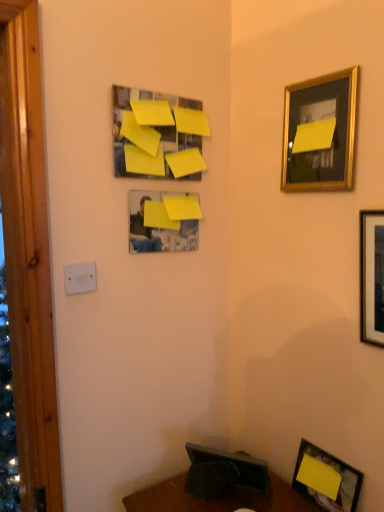
Question: Is point (84, 265) closer or farther from the camera than point (342, 181)?

Choices:
 (A) closer
 (B) farther

Answer: (B)

Question: Considering the positions of white plastic/light switch at lower left and gold metallic picture frame at upper right, the 4th picture frame from the bottom, in the image, is white plastic/light switch at lower left bigger or smaller than gold metallic picture frame at upper right, the 4th picture frame from the bottom,?

Choices:
 (A) small
 (B) big

Answer: (A)

Question: Estimate the real-world distances between objects in this image. Which object is farther from the wooden framed picture at right, arranged as the fourth picture frame when viewed from the top?

Choices:
 (A) white plastic/light switch at lower left
 (B) yellow matte picture frame at upper center, which is the 4th picture frame from right to left
 (C) yellow paper at upper center, positioned as the first picture frame in top-to-bottom order
 (D) gold metallic picture frame at upper right, which is counted as the third picture frame, starting from the left
 (E) yellow matte paper at lower right, the fifth picture frame viewed from the top

Answer: (A)

Question: Which is farther from the yellow paper at upper center, the 1th picture frame viewed from the left?

Choices:
 (A) gold metallic picture frame at upper right, which is counted as the third picture frame, starting from the left
 (B) yellow matte picture frame at upper center, which is the 4th picture frame from right to left
 (C) white plastic/light switch at lower left
 (D) yellow matte paper at lower right, which is the 1th picture frame from bottom to top
 (E) wooden framed picture at right, which appears as the 2th picture frame when ordered from the bottom

Answer: (D)